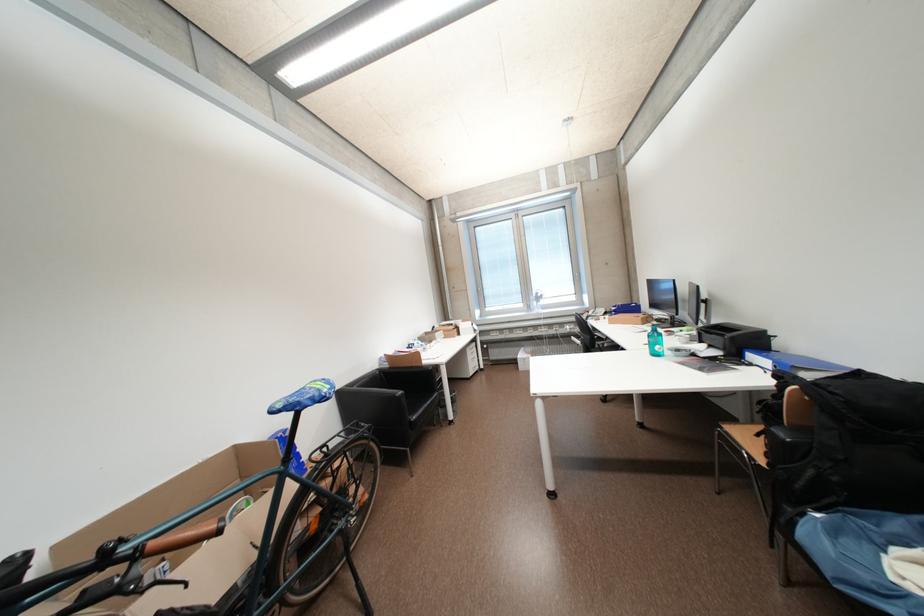
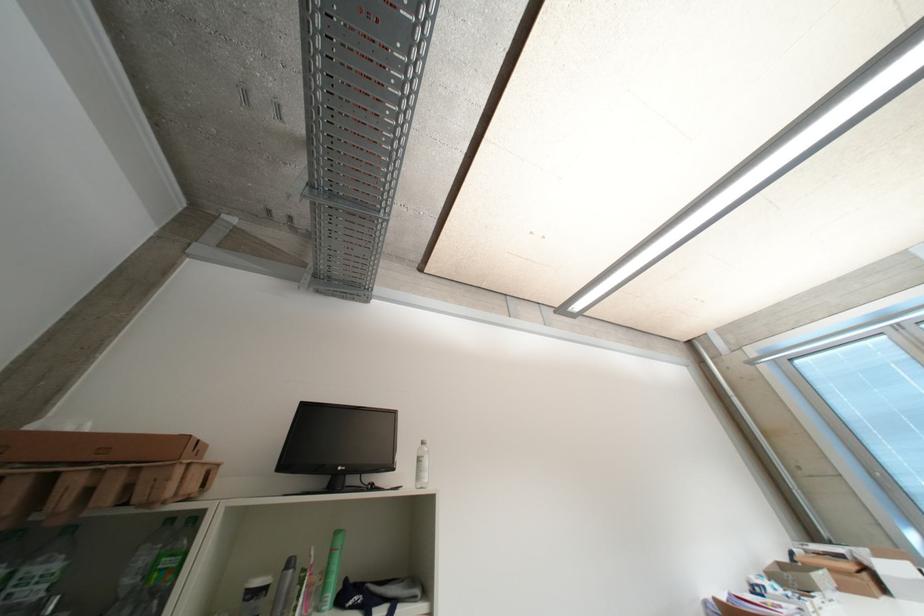
The images are taken continuously from a first-person perspective. In which direction is your viewpoint rotating?

The rotation direction of the camera is left-up.